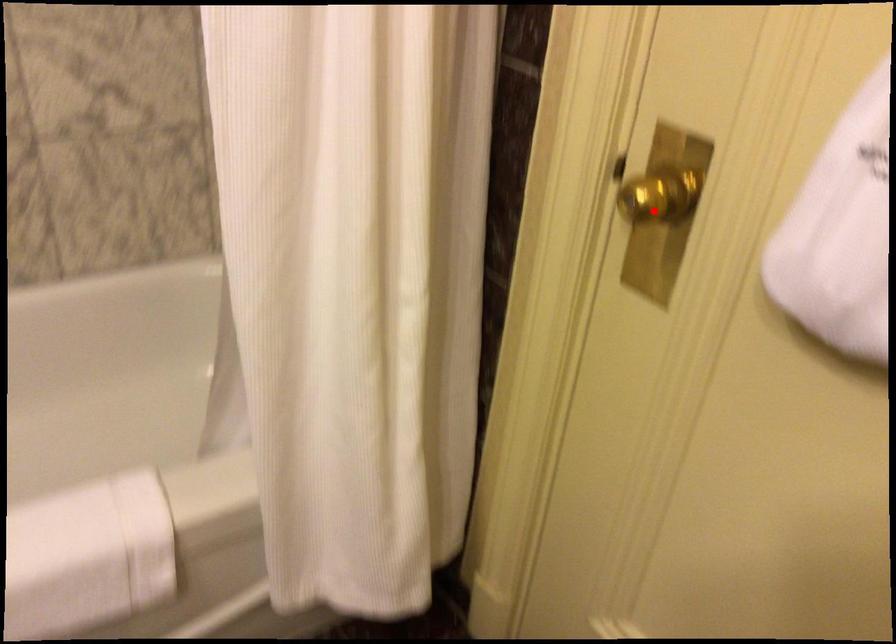
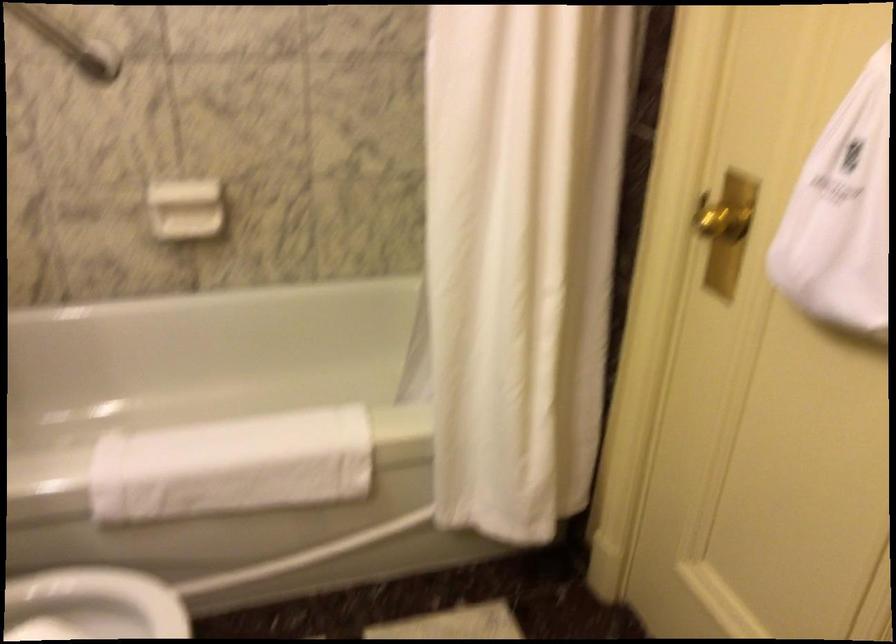
Locate, in the second image, the point that corresponds to the highlighted location in the first image.

(722, 222)